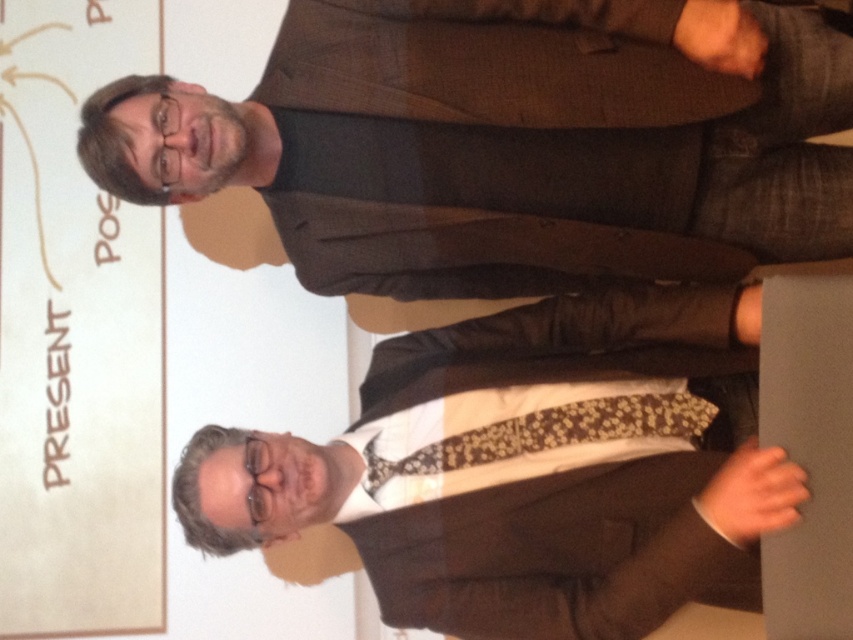
Measure the distance between brown textured suit at upper center and floral-patterned fabric tie at center.

brown textured suit at upper center and floral-patterned fabric tie at center are 34.69 centimeters apart from each other.

Is brown textured suit at upper center to the left of floral-patterned fabric tie at center from the viewer's perspective?

In fact, brown textured suit at upper center is to the right of floral-patterned fabric tie at center.

Is point (584, 128) in front of point (555, 412)?

Yes, it is in front of point (555, 412).

Locate an element on the screen. Image resolution: width=853 pixels, height=640 pixels. brown textured suit at upper center is located at coordinates (546, 156).

Can you confirm if brown textured suit at center is bigger than floral-patterned fabric tie at center?

Indeed, brown textured suit at center has a larger size compared to floral-patterned fabric tie at center.

Find the location of `brown textured suit at center`. brown textured suit at center is located at coordinates coord(526,474).

Who is positioned more to the left, brown textured suit at upper center or brown textured suit at center?

brown textured suit at center is more to the left.

In the scene shown: Can you confirm if brown textured suit at upper center is smaller than brown textured suit at center?

Yes, brown textured suit at upper center is smaller than brown textured suit at center.

Find the location of a particular element. The image size is (853, 640). brown textured suit at upper center is located at coordinates (546, 156).